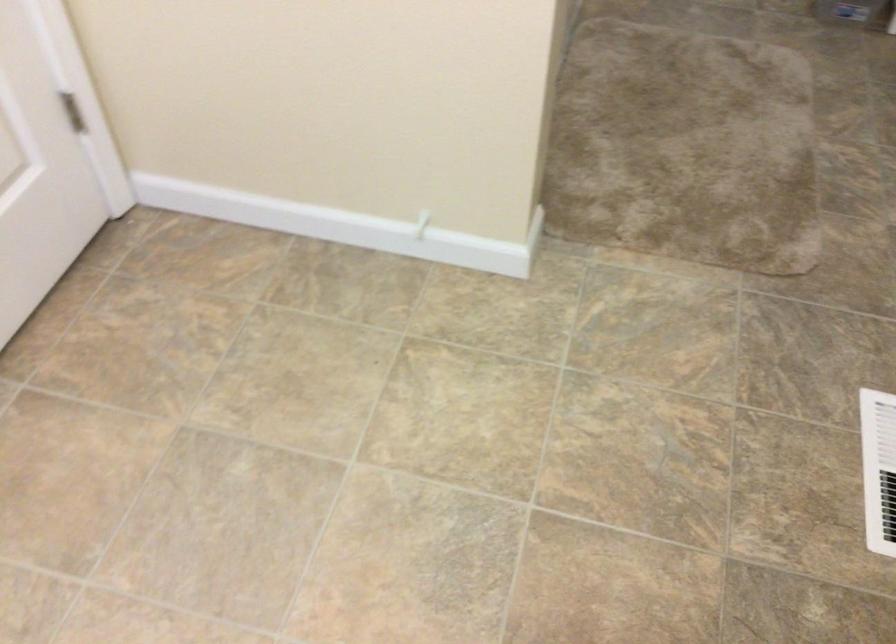
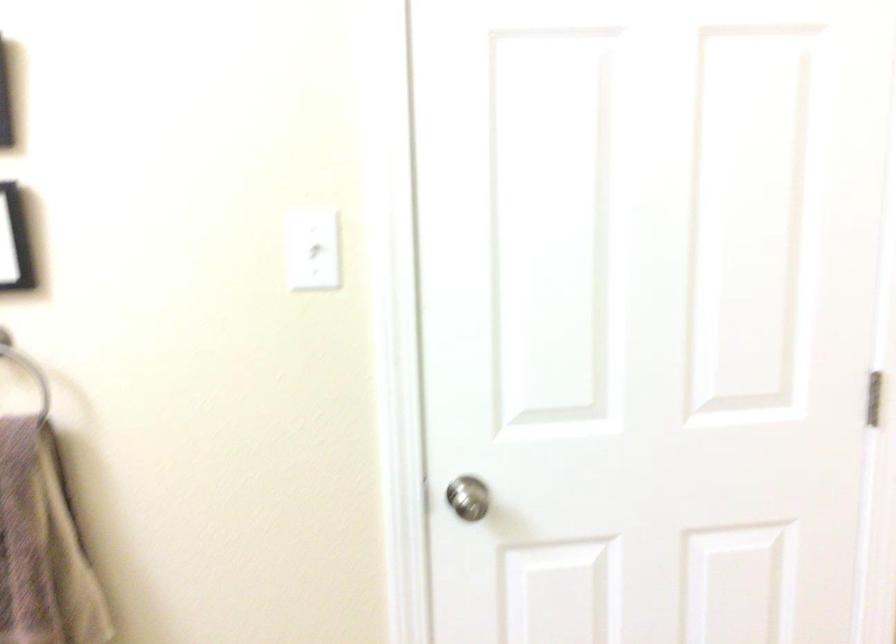
Question: The camera is either moving clockwise (left) or counter-clockwise (right) around the object. The first image is from the beginning of the video and the second image is from the end. Is the camera moving left or right when shooting the video?

Choices:
 (A) Left
 (B) Right

Answer: (B)